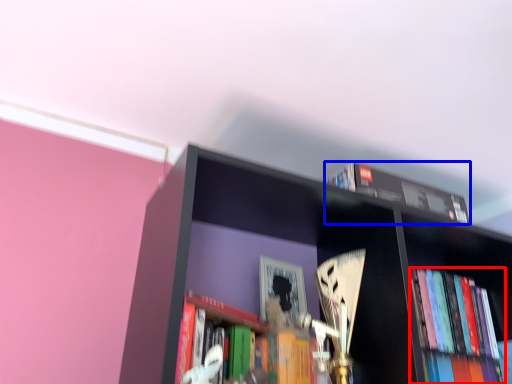
Question: Which point is closer to the camera, book (highlighted by a red box) or book (highlighted by a blue box)?

Choices:
 (A) book
 (B) book

Answer: (B)